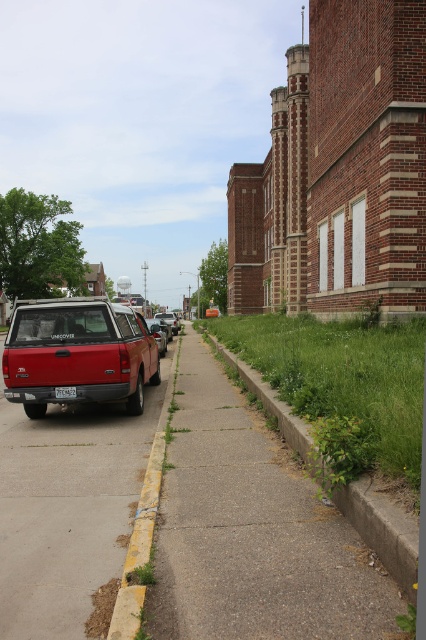
Question: Which is nearer to the green concrete curb at lower right?

Choices:
 (A) yellow concrete curb at lower left
 (B) matte red truck at left
 (C) concrete sidewalk at lower left
 (D) metallic silver sedan at center

Answer: (A)

Question: Which object is positioned closest to the black metal license plate at center?

Choices:
 (A) concrete sidewalk at lower left
 (B) green concrete curb at lower right

Answer: (A)

Question: Does matte red truck at left appear over yellow concrete curb at lower left?

Choices:
 (A) no
 (B) yes

Answer: (B)

Question: Is concrete sidewalk at lower left below metallic silver sedan at center?

Choices:
 (A) no
 (B) yes

Answer: (B)

Question: Which of these objects is positioned farthest from the black metal license plate at center?

Choices:
 (A) concrete sidewalk at lower left
 (B) metallic silver sedan at center
 (C) matte red truck at left

Answer: (B)

Question: Does concrete sidewalk at lower left have a smaller size compared to green concrete curb at lower right?

Choices:
 (A) yes
 (B) no

Answer: (B)